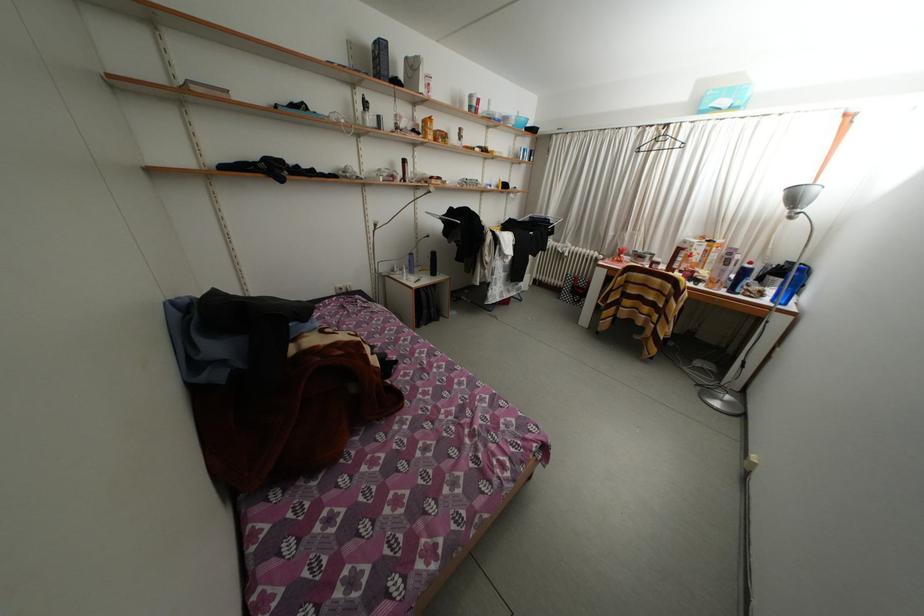
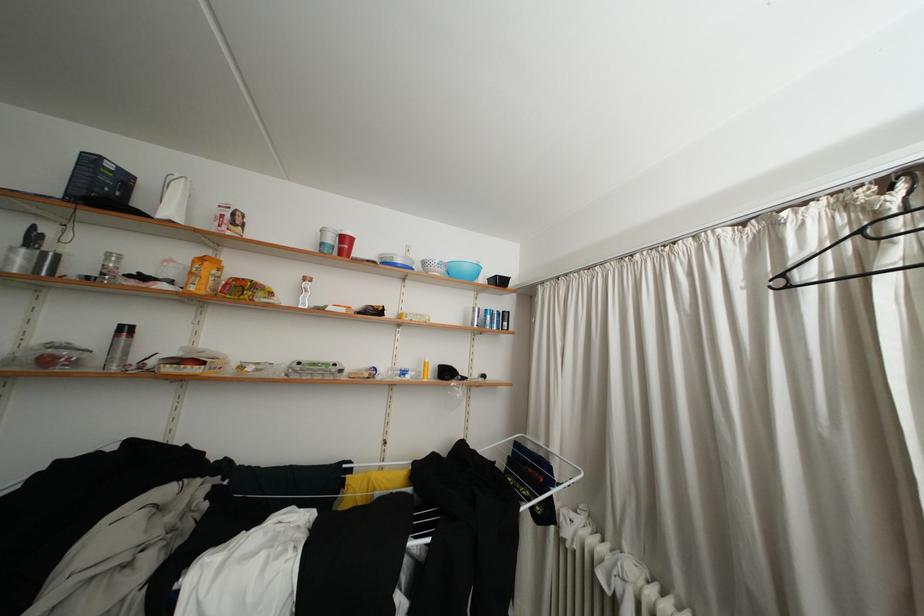
The point at (551, 220) is marked in the first image. Where is the corresponding point in the second image?

(550, 448)